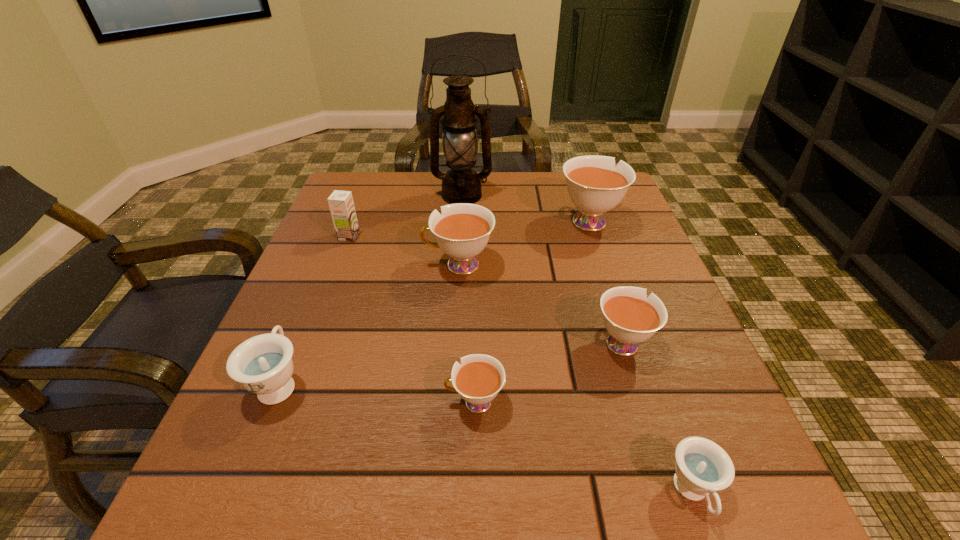
Identify the location of oil lamp. The height and width of the screenshot is (540, 960). pos(461,184).

I want to click on the tallest object, so click(x=461, y=184).

This screenshot has width=960, height=540. Find the location of `the tallest teacup`. the tallest teacup is located at coordinates (594, 185).

The width and height of the screenshot is (960, 540). Find the location of `the biggest white teacup`. the biggest white teacup is located at coordinates (594, 185).

Identify the location of chocolate milk. pos(341,204).

I want to click on the second farthest teacup, so click(462, 231).

Find the location of `the third nearest white teacup`. the third nearest white teacup is located at coordinates pyautogui.click(x=462, y=231).

What are the coordinates of `the third farthest white teacup` in the screenshot? It's located at (630, 317).

This screenshot has width=960, height=540. I want to click on the left blue teacup, so click(263, 364).

I want to click on the bigger blue teacup, so click(263, 364).